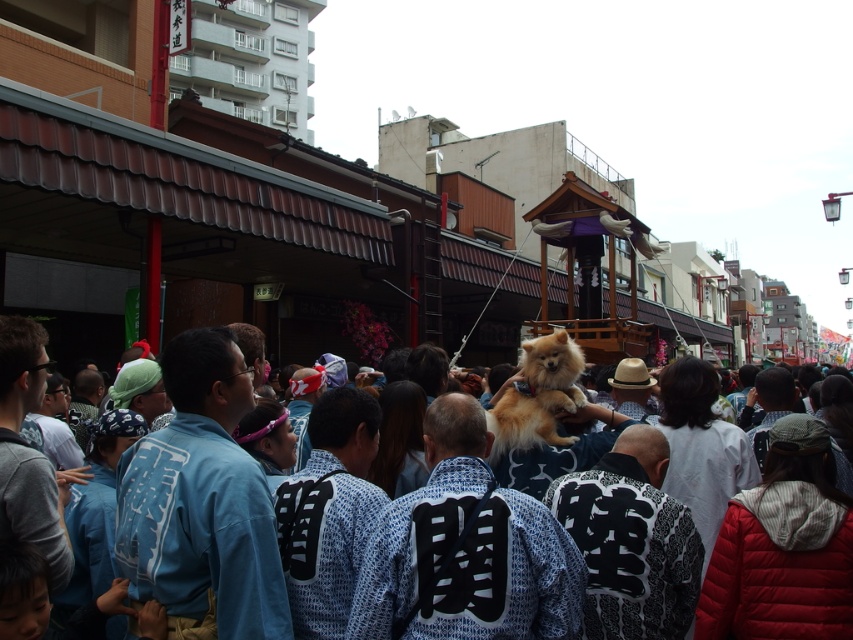
You are a photographer trying to capture both the fluffy brown dog at center and the golden fur dog at center in a single shot. Given their sizes, which dog should you focus on to ensure both are fully visible in the frame?

The fluffy brown dog at center is larger than the golden fur dog at center. To ensure both are fully visible, focus on the larger fluffy brown dog at center and adjust the framing to accommodate its size while keeping the smaller golden fur dog at center in view.

You are a participant in the festival wearing a yuuto with a kanji character on your back. You need to move from your current position to a specific location marked by point (560, 342). However, there is another participant standing at point (213, 588). Based on the scene description, can you safely walk around them to reach your destination without getting too close?

Point (213, 588) is in front of point (560, 342). Since the participant at point (213, 588) is blocking your path to point (560, 342), you would need to navigate around them. However, given their position is in front of your destination, moving around them might require careful maneuvering to avoid getting too close, especially in the crowded festival setting described.

You are a photographer at the festival. You want to take a photo of the fluffy brown dog at center and the golden fur dog at center. Which dog should you focus on first if you want to capture both in the same frame without moving the camera?

The fluffy brown dog at center is below the golden fur dog at center, so you should focus on the golden fur dog at center first to ensure both are in the frame without moving the camera.